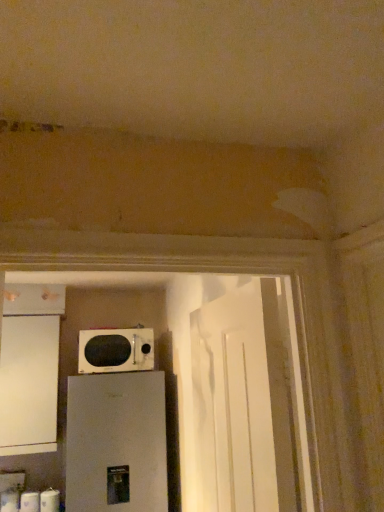
Question: Considering the positions of point (8, 337) and point (102, 356), is point (8, 337) closer or farther from the camera than point (102, 356)?

Choices:
 (A) closer
 (B) farther

Answer: (B)

Question: Considering their positions, is white matte cabinet at left located in front of or behind white glossy microwave at center?

Choices:
 (A) behind
 (B) front

Answer: (B)

Question: Which object is positioned closest to the white glossy microwave at center?

Choices:
 (A) white matte toilet paper at lower left, which ranks as the third toilet paper in right-to-left order
 (B) white matte toilet paper at lower left, which is the second toilet paper in left-to-right order
 (C) white matte toilet paper at lower left, which is counted as the 1th toilet paper, starting from the right
 (D) white matte refrigerator at lower left
 (E) white glossy door at center

Answer: (D)

Question: Based on their relative distances, which object is farther from the white matte toilet paper at lower left, which ranks as the third toilet paper in right-to-left order?

Choices:
 (A) white glossy door at center
 (B) white glossy microwave at center
 (C) white matte refrigerator at lower left
 (D) white matte toilet paper at lower left, which is counted as the 1th toilet paper, starting from the right
 (E) white matte cabinet at left

Answer: (A)